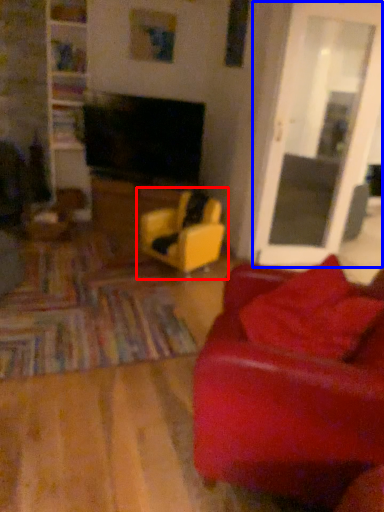
Question: Among these objects, which one is nearest to the camera, chair (highlighted by a red box) or glass door (highlighted by a blue box)?

Choices:
 (A) chair
 (B) glass door

Answer: (B)